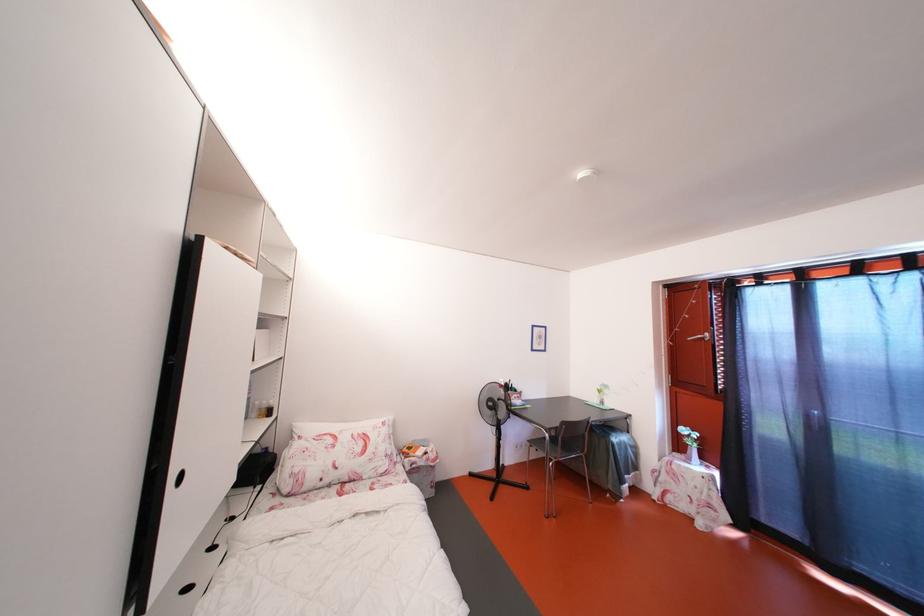
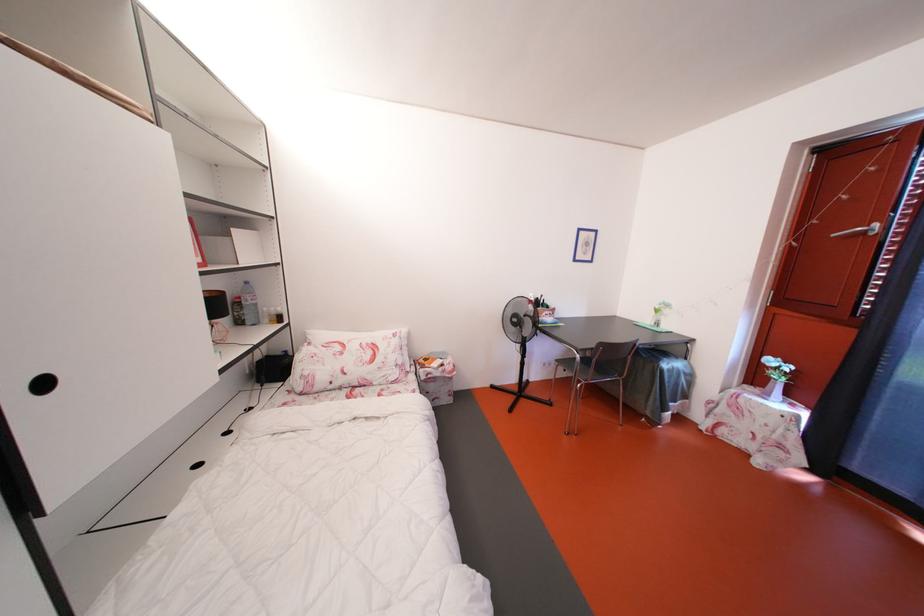
The point at (553,440) is marked in the first image. Where is the corresponding point in the second image?

(585, 362)